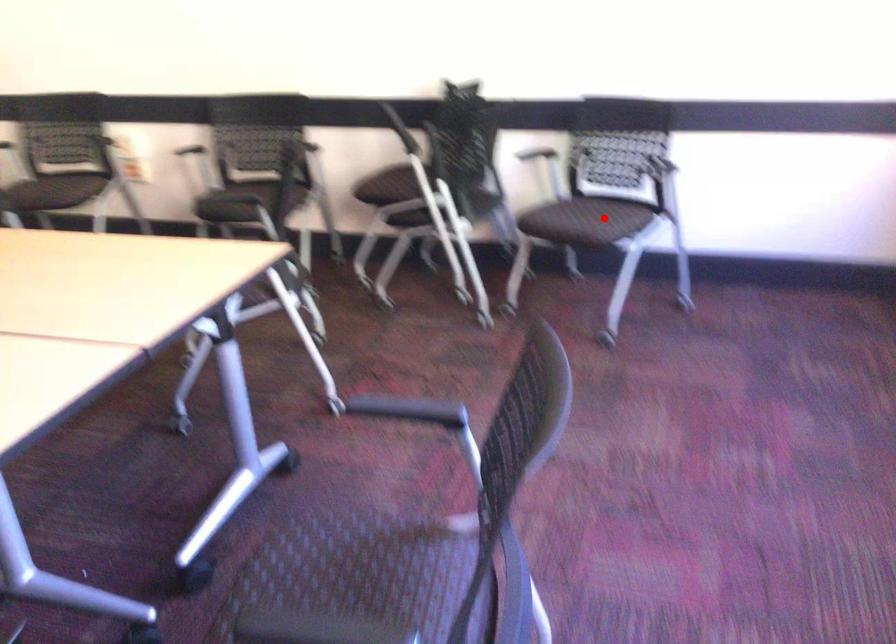
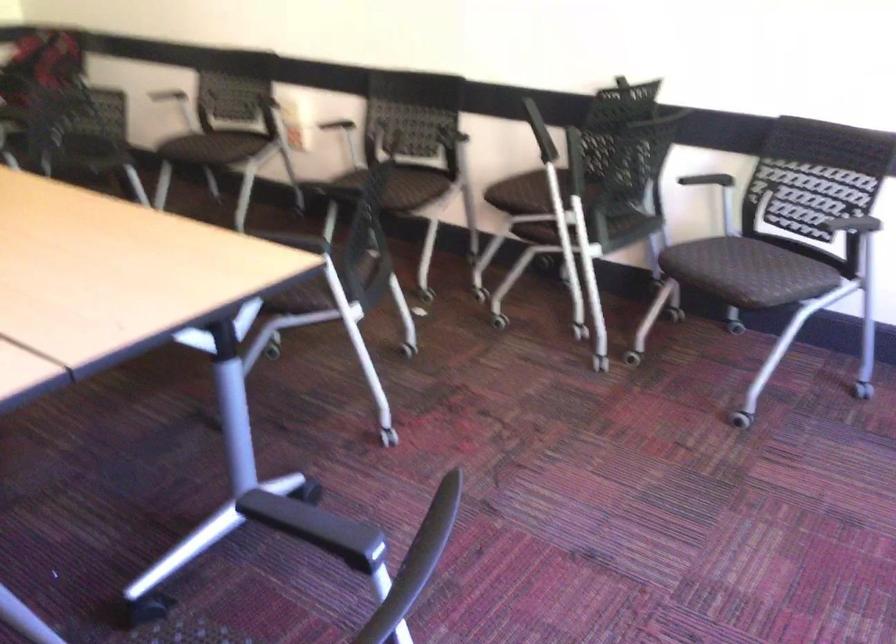
Question: I am providing you with two images of the same scene from different viewpoints. Image1 has a red point marked. In image2, the corresponding 3D location appears at what relative position? Reply with the corresponding letter.

Choices:
 (A) Closer
 (B) Farther

Answer: (A)